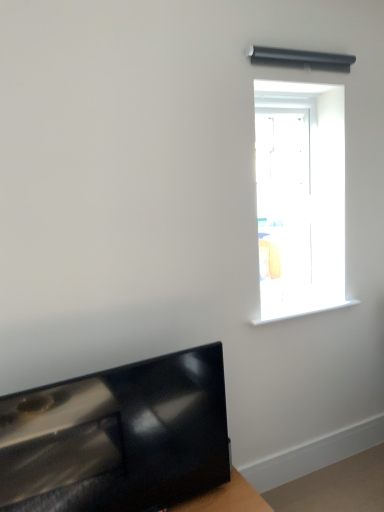
Locate an element on the screen. The image size is (384, 512). free spot above transparent glass door at upper right (from a real-world perspective) is located at coordinates coord(284,87).